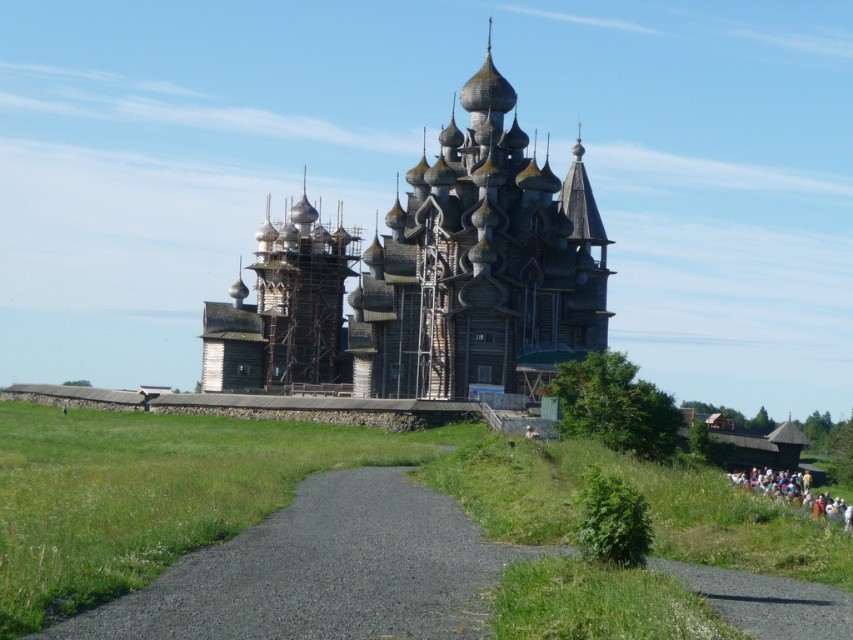
You are a photographer planning to capture the wooden church at center and the white cotton crowd at lower right in a single frame. Given that your camera has a fixed focal length, which object should you position closer to the center of the frame to ensure both fit within the shot?

Since the wooden church at center is wider than the white cotton crowd at lower right, you should position the wooden church at center closer to the center of the frame to ensure both fit within the shot.

You are standing at the base of the cathedral and want to take a photo that includes both the point at coordinates point (376, 312) and point (790, 484). Which point should you position closer to the camera to ensure both are in the frame?

Since point (376, 312) is closer to the viewer than point (790, 484), you should position yourself closer to point (376, 312) to ensure both points are within the camera frame.

You are a photographer planning to take a photo of the wooden church at center and the white cotton crowd at lower right. Based on their sizes, which object should you focus on first if you want to ensure both are in frame without needing to adjust your camera angle?

The wooden church at center is much taller than the white cotton crowd at lower right, so you should focus on the wooden church at center first to ensure it fits within the frame while still capturing the white cotton crowd at lower right.